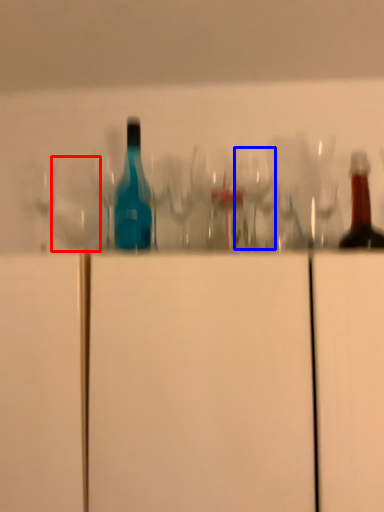
Question: Which of the following is the farthest to the observer, shot glass (highlighted by a red box) or wine glass (highlighted by a blue box)?

Choices:
 (A) shot glass
 (B) wine glass

Answer: (A)